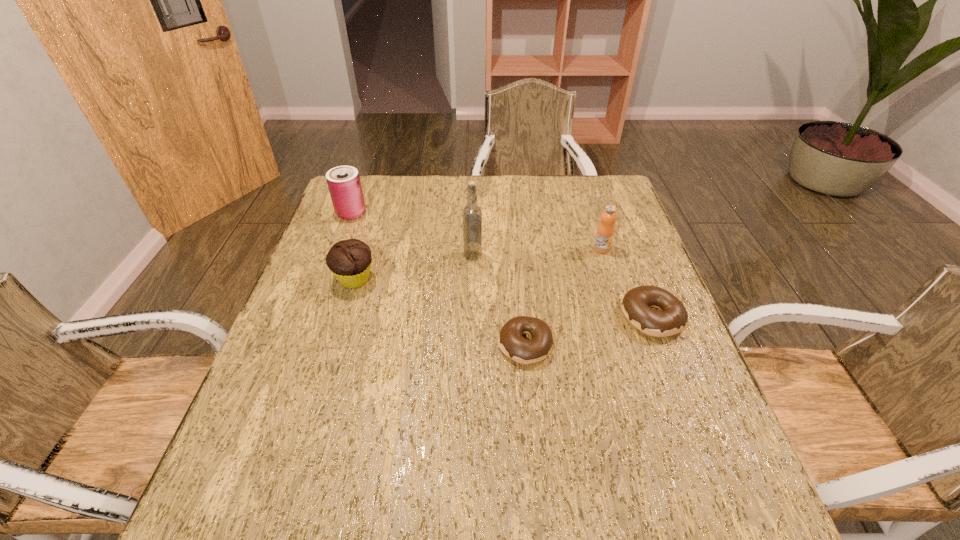
Locate an element on the screen. The height and width of the screenshot is (540, 960). free spot between the shortest object and the tallest object is located at coordinates (499, 300).

Locate an element on the screen. The width and height of the screenshot is (960, 540). free spot between the orange juice and the fourth object from left to right is located at coordinates (x=564, y=297).

Identify the location of free space between the vodka and the muffin. (414, 267).

Image resolution: width=960 pixels, height=540 pixels. Identify the location of free area in between the farthest object and the vodka. (412, 234).

The height and width of the screenshot is (540, 960). In order to click on vacant region between the second shortest object and the third object from right to left in this screenshot , I will do `click(588, 331)`.

You are a GUI agent. You are given a task and a screenshot of the screen. Output one action in this format:
    pyautogui.click(x=<x>, y=<y>)
    Task: Click on the free spot between the orange juice and the shorter doughnut
    The image size is (960, 540).
    Given the screenshot: What is the action you would take?
    pyautogui.click(x=564, y=297)

The width and height of the screenshot is (960, 540). What are the coordinates of `free point between the orange juice and the tallest object` in the screenshot? It's located at (538, 252).

Locate an element on the screen. the third closest object to the tallest object is located at coordinates (605, 231).

Point out which object is positioned as the fifth nearest to the farthest object. Please provide its 2D coordinates. Your answer should be formatted as a tuple, i.e. [(x, y)], where the tuple contains the x and y coordinates of a point satisfying the conditions above.

[(636, 303)]

Identify the location of vacant space that satisfies the following two spatial constraints: 1. on the label of the tallest object; 2. on the back side of the shorter doughnut. (471, 345).